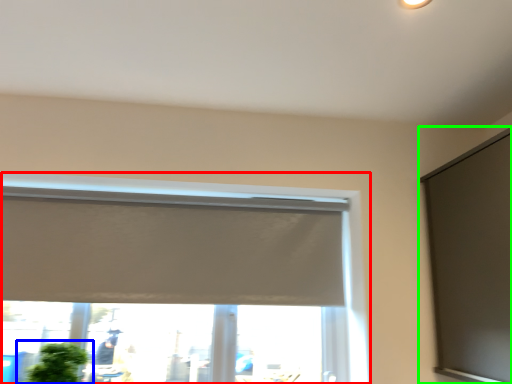
Question: Which object is positioned farthest from window (highlighted by a red box)? Select from houseplant (highlighted by a blue box) and window screen (highlighted by a green box).

Choices:
 (A) houseplant
 (B) window screen

Answer: (A)